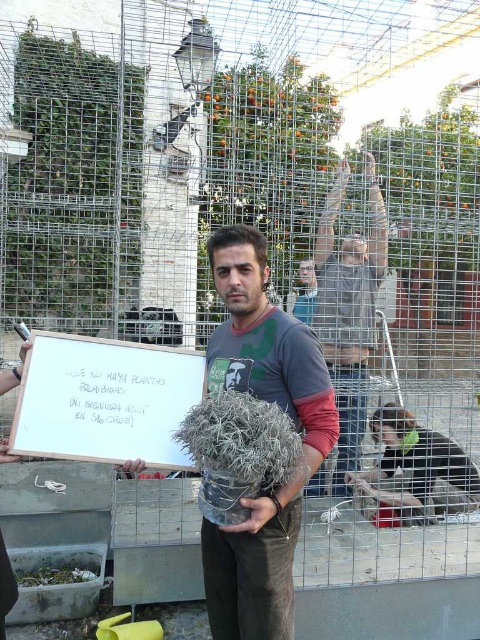
Is gray cotton shirt at center behind green fuzzy plant at center?

Yes, it is behind green fuzzy plant at center.

Does point (321, 310) come in front of point (254, 432)?

No, it is not.

Between point (350, 344) and point (269, 420), which one is positioned in front?

Point (269, 420)

You are a GUI agent. You are given a task and a screenshot of the screen. Output one action in this format:
    pyautogui.click(x=<x>, y=<y>)
    Task: Click on the gray cotton shirt at center
    
    Given the screenshot: What is the action you would take?
    pyautogui.click(x=348, y=310)

Is green leafy plant at center below blue fabric shirt at center?

No, green leafy plant at center is not below blue fabric shirt at center.

Which is below, green leafy plant at center or blue fabric shirt at center?

blue fabric shirt at center is below.

Find the location of a particular element. This screenshot has width=480, height=640. green leafy plant at center is located at coordinates (72, 182).

Is green leafy plant at center above white paper sign at center?

Correct, green leafy plant at center is located above white paper sign at center.

How far apart are green leafy plant at center and white paper sign at center?

A distance of 3.90 meters exists between green leafy plant at center and white paper sign at center.

Between point (110, 260) and point (47, 392), which one is positioned behind?

The point (110, 260) is more distant.

Where is `green leafy plant at center`? This screenshot has width=480, height=640. green leafy plant at center is located at coordinates (72, 182).